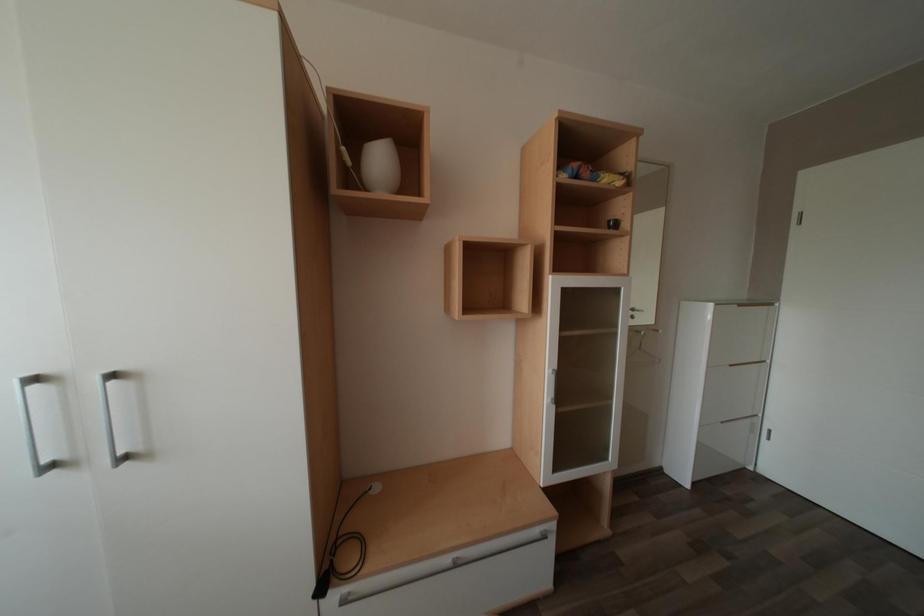
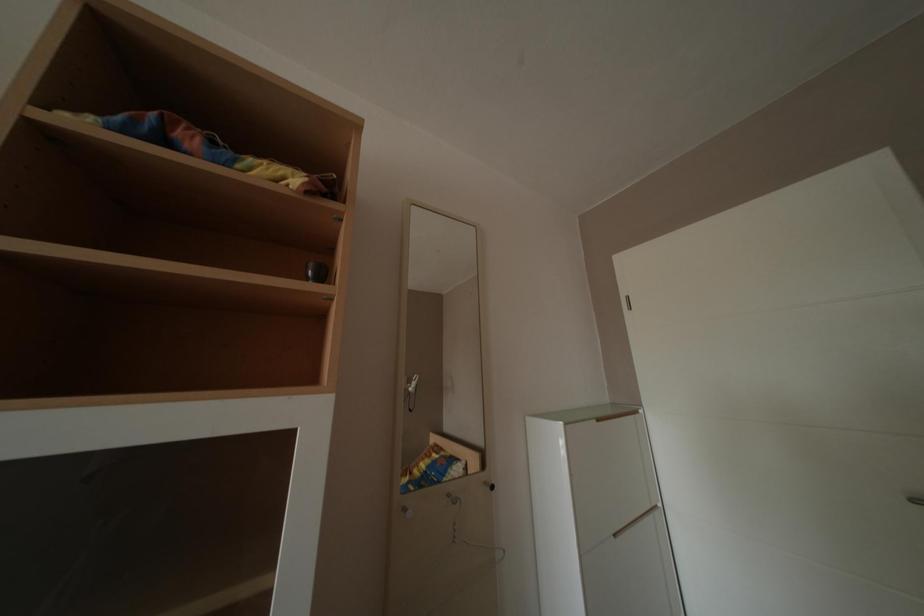
Looking at this image, what movement of the cameraman would produce the second image?

The cameraman walked toward right, forward.